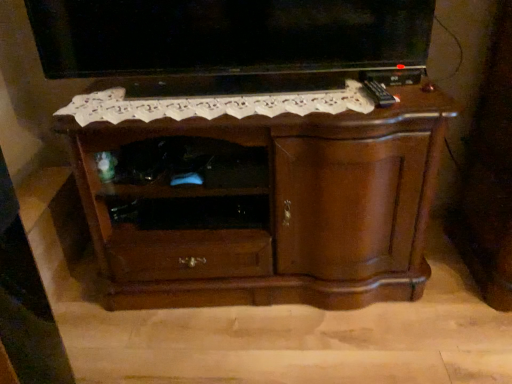
You are a GUI agent. You are given a task and a screenshot of the screen. Output one action in this format:
    pyautogui.click(x=<x>, y=<y>)
    Task: Click on the free region under matte black tv at upper center (from a real-world perspective)
    Image resolution: width=512 pixels, height=384 pixels.
    Given the screenshot: What is the action you would take?
    pyautogui.click(x=219, y=90)